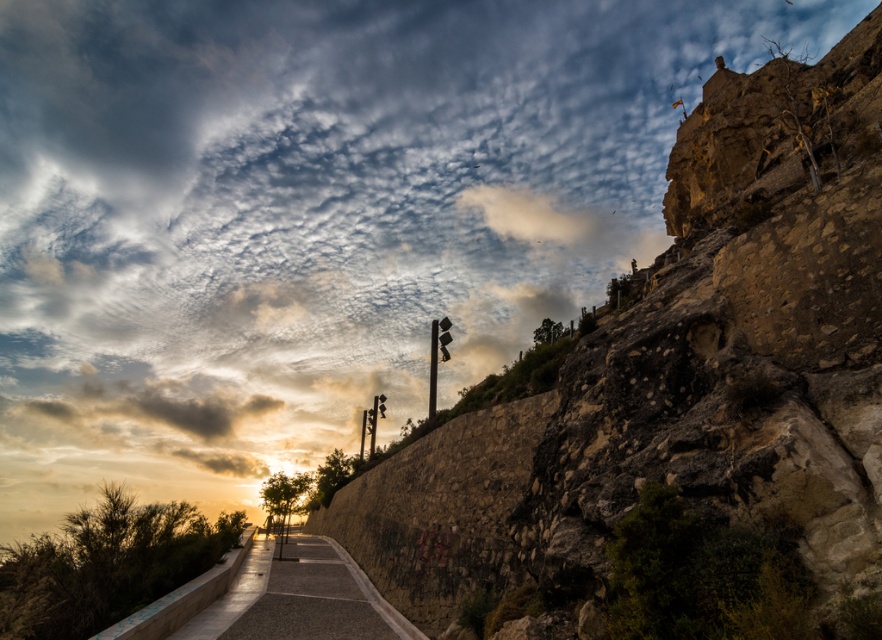
Question: Observing the image, what is the correct spatial positioning of rustic stone wall at center in reference to smooth concrete path at center?

Choices:
 (A) below
 (B) above

Answer: (B)

Question: Which object appears closest to the camera in this image?

Choices:
 (A) rustic stone wall at center
 (B) smooth concrete path at center

Answer: (A)

Question: Among these points, which one is farthest from the camera?

Choices:
 (A) (637, 442)
 (B) (290, 545)

Answer: (B)

Question: Does rustic stone wall at center have a lesser width compared to smooth concrete path at center?

Choices:
 (A) yes
 (B) no

Answer: (B)

Question: Can you confirm if rustic stone wall at center is positioned above smooth concrete path at center?

Choices:
 (A) yes
 (B) no

Answer: (A)